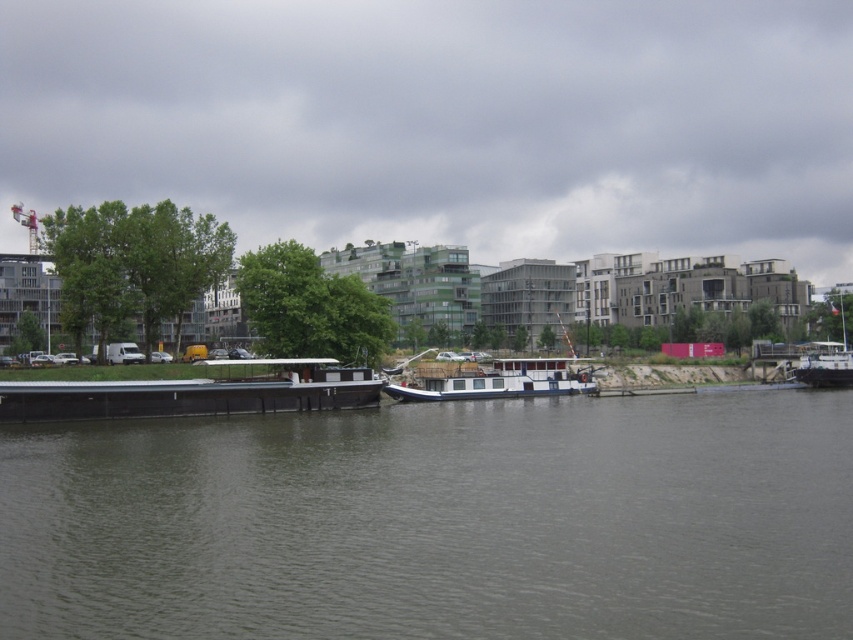
Question: Which point is closer to the camera?

Choices:
 (A) (718, 602)
 (B) (840, 344)
 (C) (0, 403)
 (D) (451, 387)

Answer: (A)

Question: Can you confirm if black matte barge at lower left is wider than white matte barge at center?

Choices:
 (A) yes
 (B) no

Answer: (A)

Question: Which of the following is the farthest from the observer?

Choices:
 (A) gray smooth water at center
 (B) black matte barge at lower left
 (C) white wooden boat at right

Answer: (C)

Question: Which of the following is the farthest from the observer?

Choices:
 (A) white wooden boat at right
 (B) white matte barge at center
 (C) black matte barge at lower left
 (D) gray smooth water at center

Answer: (A)

Question: Is black matte barge at lower left to the right of white matte barge at center from the viewer's perspective?

Choices:
 (A) no
 (B) yes

Answer: (A)

Question: Is white matte barge at center thinner than white wooden boat at right?

Choices:
 (A) no
 (B) yes

Answer: (B)